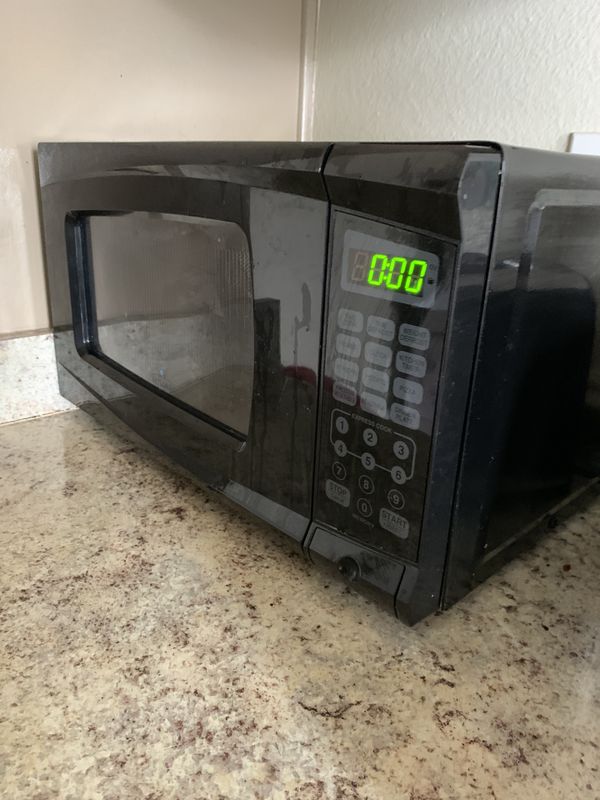
Find the location of a particular element. The height and width of the screenshot is (800, 600). wall is located at coordinates (430, 85).